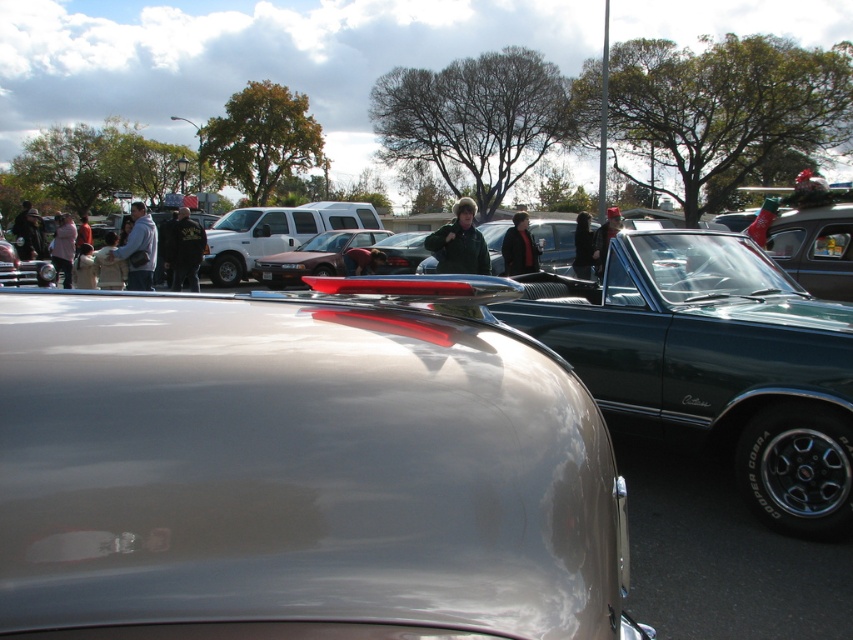
Question: Does matte red sedan at center have a greater width compared to dark brown leather jacket at center?

Choices:
 (A) yes
 (B) no

Answer: (B)

Question: Which object is farther from the camera taking this photo?

Choices:
 (A) shiny silver car at center
 (B) black leather jacket at center
 (C) matte red car at center
 (D) light pink fabric jacket at left

Answer: (C)

Question: Is denim jacket at left positioned before shiny silver car at center?

Choices:
 (A) no
 (B) yes

Answer: (B)

Question: Which point is farther to the camera?

Choices:
 (A) green matte jacket at center
 (B) matte red sedan at center
 (C) matte red car at center

Answer: (B)

Question: Can you confirm if shiny silver car at center is wider than dark green leather jacket at center?

Choices:
 (A) yes
 (B) no

Answer: (B)

Question: Among these objects, which one is farthest from the camera?

Choices:
 (A) light pink fabric jacket at left
 (B) dark brown leather jacket at center
 (C) green matte jacket at center

Answer: (A)